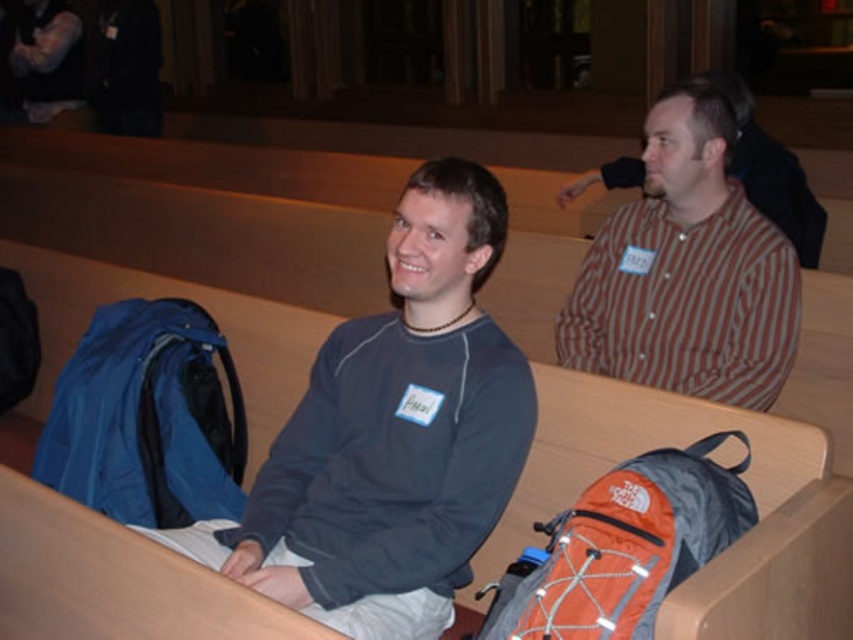
Question: Which point is farther to the camera?

Choices:
 (A) (595, 516)
 (B) (142, 314)
 (C) (606, 288)

Answer: (B)

Question: From the image, what is the correct spatial relationship of matte gray sweater at center in relation to blue fabric backpack at lower left?

Choices:
 (A) above
 (B) below

Answer: (A)

Question: Considering the relative positions of matte gray sweater at center and orange fabric backpack at lower center in the image provided, where is matte gray sweater at center located with respect to orange fabric backpack at lower center?

Choices:
 (A) above
 (B) below

Answer: (A)

Question: Which point is closer to the camera?

Choices:
 (A) (448, 182)
 (B) (746, 252)

Answer: (A)

Question: Is matte gray sweater at center to the right of orange fabric backpack at lower center from the viewer's perspective?

Choices:
 (A) yes
 (B) no

Answer: (B)

Question: Which of the following is the closest to the observer?

Choices:
 (A) blue fabric backpack at lower left
 (B) striped cotton shirt at upper right

Answer: (A)